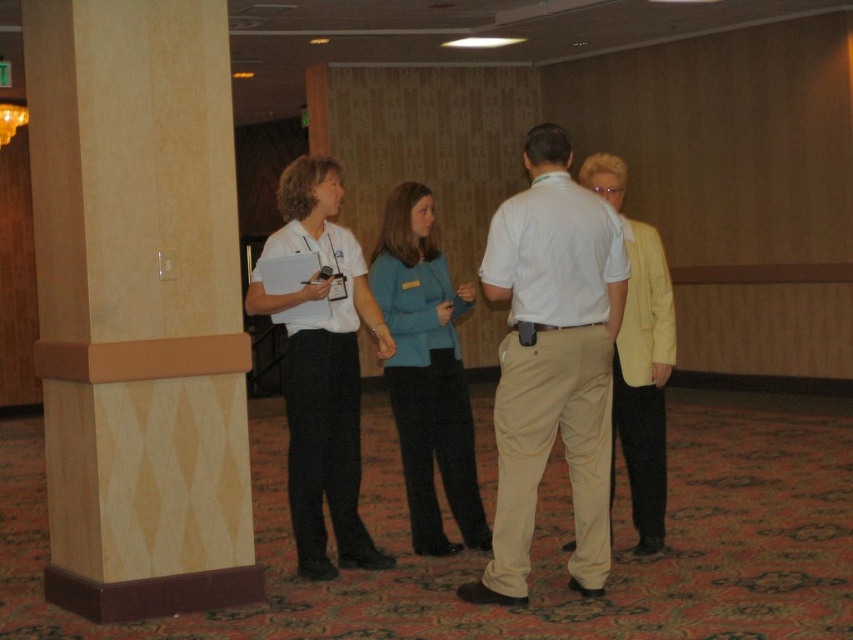
You are standing in the conference room and want to hand a document to both the white matte shirt at center and the light yellow fabric jacket at right. Which person should you approach first to ensure you can reach them without moving around the pillar?

You should approach the white matte shirt at center first because they are closer to you than the light yellow fabric jacket at right, who is further away. Since the white matte shirt is closer, you can reach them without needing to move around the pillar first.

You are standing in the conference room and want to move from the point at coordinates point (564,330) to the point at coordinates point (344,536). Which direction should you move to get closer to your destination?

To move from point (564,330) to point (344,536), you should move downward and to the right since point (344,536) is located below and to the right of point (564,330).

You are standing at point (x=552, y=362) in the conference room. What is the nearest object to you?

The nearest object to you at point (x=552, y=362) is the white cotton shirt at center.